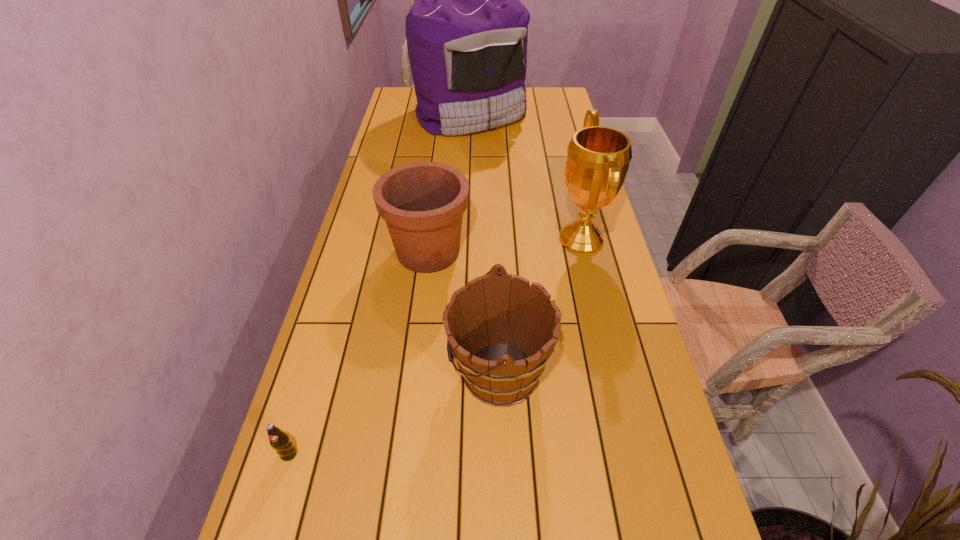
This screenshot has width=960, height=540. I want to click on pop located in the left edge section of the desktop, so click(x=279, y=440).

Locate an element on the screen. object that is at the right edge is located at coordinates (598, 157).

Where is `object positioned at the far left corner`? object positioned at the far left corner is located at coordinates (467, 33).

What are the coordinates of `vacant region at the left edge` in the screenshot? It's located at (362, 303).

The image size is (960, 540). I want to click on vacant area at the right edge of the desktop, so [x=541, y=152].

Where is `free point at the far left corner`? free point at the far left corner is located at coordinates (403, 93).

The height and width of the screenshot is (540, 960). What are the coordinates of `free space between the award and the flowerpot` in the screenshot? It's located at (505, 245).

At what (x,y) coordinates should I click in order to perform the action: click on vacant area that lies between the shortest object and the fourth farthest object. Please return your answer as a coordinate pair (x, y). The width and height of the screenshot is (960, 540). Looking at the image, I should click on (394, 413).

The width and height of the screenshot is (960, 540). What are the coordinates of `free space between the flowerpot and the shortest object` in the screenshot? It's located at click(359, 353).

This screenshot has height=540, width=960. What are the coordinates of `empty space between the pop and the wine bucket` in the screenshot? It's located at (394, 413).